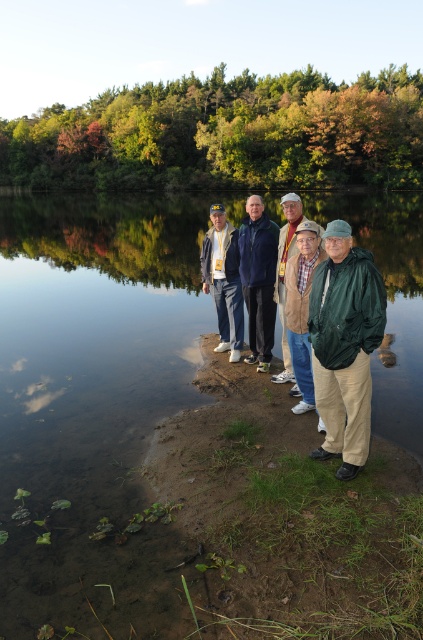
You are standing at the edge of the lake and want to find the clearest part of the water to take a photo of the reflection. According to the scene description, where should you position yourself relative to the clear water at shore center?

You should position yourself directly at the clear water at shore center, as that is the location specified as the clearest part of the water in the scene description.

You are standing at the edge of the lake and want to find the green matte jacket at center. Based on the coordinates provided, in which direction should you look relative to your current position?

The green matte jacket at center is located at coordinates point (x=345, y=346), which means you should look towards the center area of the scene to find it.